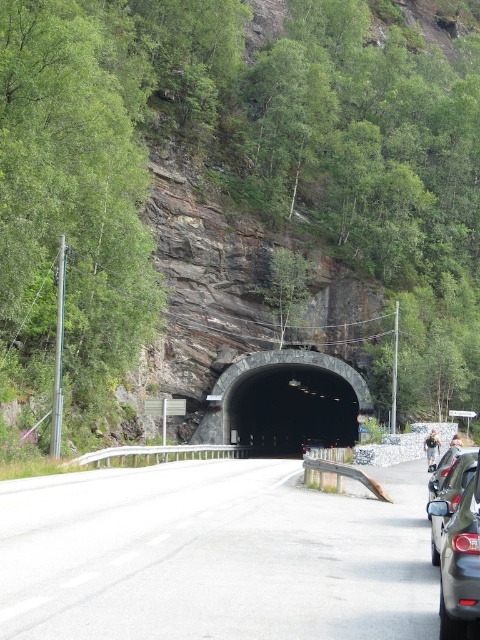
Based on the photo, does gray asphalt road at center have a greater height compared to metallic silver car at right?

Yes, gray asphalt road at center is taller than metallic silver car at right.

Is gray asphalt road at center positioned in front of metallic silver car at right?

Yes, it is in front of metallic silver car at right.

Where is `gray asphalt road at center`? The width and height of the screenshot is (480, 640). gray asphalt road at center is located at coordinates (214, 556).

This screenshot has height=640, width=480. Find the location of `gray asphalt road at center`. gray asphalt road at center is located at coordinates (214, 556).

Can you confirm if dark gray concrete tunnel at center is positioned to the left of matte black car at right?

In fact, dark gray concrete tunnel at center is to the right of matte black car at right.

Who is positioned more to the right, dark gray concrete tunnel at center or matte black car at right?

dark gray concrete tunnel at center

What are the coordinates of `dark gray concrete tunnel at center` in the screenshot? It's located at [x=286, y=401].

The image size is (480, 640). What are the coordinates of `dark gray concrete tunnel at center` in the screenshot? It's located at (286, 401).

Does dark gray concrete tunnel at center appear over metallic silver car at right?

Actually, dark gray concrete tunnel at center is below metallic silver car at right.

Measure the distance between dark gray concrete tunnel at center and metallic silver car at right.

45.04 meters

Between point (339, 416) and point (462, 477), which one is positioned in front?

Point (462, 477) is more forward.

Locate an element on the screen. dark gray concrete tunnel at center is located at coordinates (286, 401).